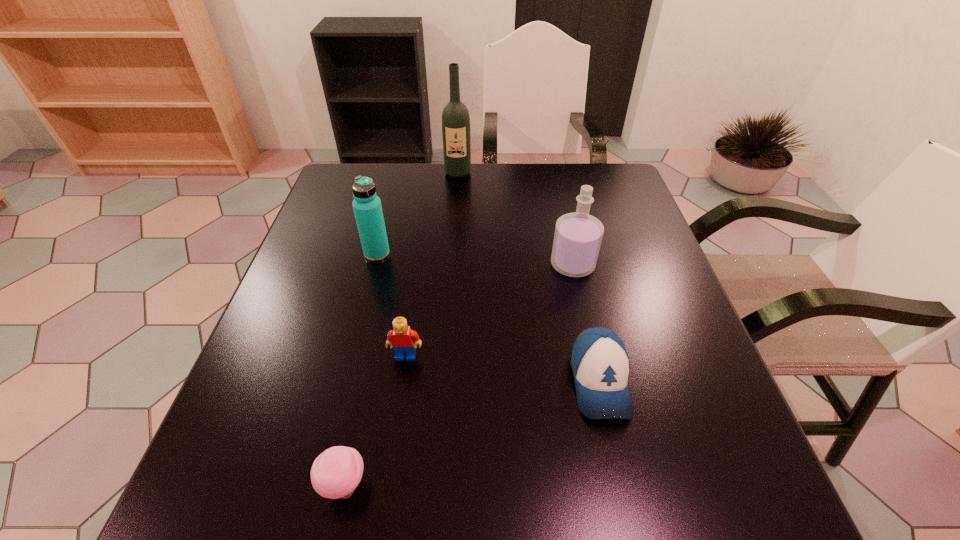
Identify the location of free spot at the far right corner of the desktop. This screenshot has height=540, width=960. (612, 194).

This screenshot has width=960, height=540. What are the coordinates of `vacant area at the near right corner of the desktop` in the screenshot? It's located at (722, 469).

You are a GUI agent. You are given a task and a screenshot of the screen. Output one action in this format:
    pyautogui.click(x=<x>, y=<y>)
    Task: Click on the free spot between the perfume and the fourth object from left to right
    The image size is (960, 540).
    Given the screenshot: What is the action you would take?
    pyautogui.click(x=516, y=219)

The height and width of the screenshot is (540, 960). I want to click on free area in between the water bottle and the tallest object, so click(x=418, y=213).

Image resolution: width=960 pixels, height=540 pixels. I want to click on vacant space in between the perfume and the wine bottle, so click(x=516, y=219).

I want to click on free spot between the third shortest object and the perfume, so click(x=490, y=310).

This screenshot has width=960, height=540. I want to click on vacant space that's between the third shortest object and the cupcake, so click(x=375, y=421).

The height and width of the screenshot is (540, 960). Find the location of `vacant point located between the water bottle and the cupcake`. vacant point located between the water bottle and the cupcake is located at coordinates (361, 370).

The image size is (960, 540). I want to click on free space between the water bottle and the baseball cap, so click(x=489, y=318).

You are a GUI agent. You are given a task and a screenshot of the screen. Output one action in this format:
    pyautogui.click(x=<x>, y=<y>)
    Task: Click on the vacant point located between the baseball cap and the water bottle
    The height and width of the screenshot is (540, 960).
    Given the screenshot: What is the action you would take?
    pyautogui.click(x=489, y=318)